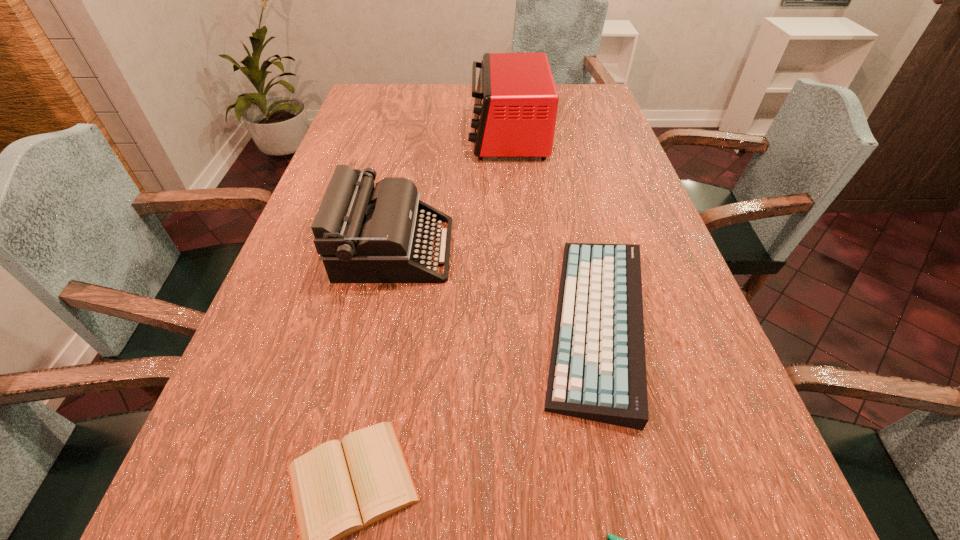
Where is `the farthest object`? Image resolution: width=960 pixels, height=540 pixels. the farthest object is located at coordinates (516, 101).

Where is `toaster oven`? The image size is (960, 540). toaster oven is located at coordinates (516, 101).

Where is `typewriter`? The width and height of the screenshot is (960, 540). typewriter is located at coordinates (365, 233).

Where is `computer keyboard`? computer keyboard is located at coordinates (597, 372).

Locate an element on the screen. The height and width of the screenshot is (540, 960). free space located 0.270m on the front-facing side of the farthest object is located at coordinates (384, 136).

You are a GUI agent. You are given a task and a screenshot of the screen. Output one action in this format:
    pyautogui.click(x=<x>, y=<y>)
    Task: Click on the vacant area situated on the front-facing side of the farthest object
    This screenshot has height=540, width=960.
    Given the screenshot: What is the action you would take?
    (441, 136)

Where is `blank space located on the front-facing side of the farthest object`? The width and height of the screenshot is (960, 540). blank space located on the front-facing side of the farthest object is located at coordinates click(x=403, y=136).

What are the coordinates of `vacant area situated 0.100m on the typing side of the second tallest object` in the screenshot? It's located at (493, 249).

This screenshot has width=960, height=540. In order to click on free space located on the left of the computer keyboard in this screenshot , I will do `click(334, 322)`.

Find the location of a particular element. The width and height of the screenshot is (960, 540). object situated at the far edge is located at coordinates (516, 101).